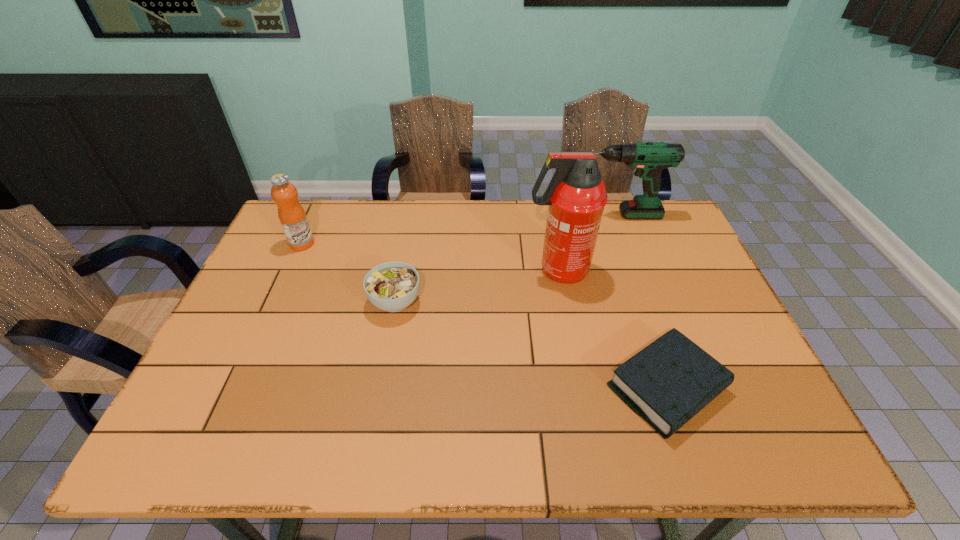
You are a GUI agent. You are given a task and a screenshot of the screen. Output one action in this format:
    pyautogui.click(x=<x>, y=<y>)
    Task: Click on the vacant space at the far right corner of the desktop
    The width and height of the screenshot is (960, 540).
    Given the screenshot: What is the action you would take?
    pyautogui.click(x=685, y=236)

Where is `vacant space that is in between the drill and the second shortest object`? The image size is (960, 540). vacant space that is in between the drill and the second shortest object is located at coordinates (506, 258).

This screenshot has width=960, height=540. I want to click on vacant space in between the fourth tallest object and the shortest object, so click(x=531, y=345).

The image size is (960, 540). I want to click on empty space that is in between the drill and the leftmost object, so click(459, 230).

Locate an element on the screen. The width and height of the screenshot is (960, 540). free space between the Bible and the tallest object is located at coordinates (612, 329).

Image resolution: width=960 pixels, height=540 pixels. Identify the location of blank region between the fire extinguisher and the nearest object. (612, 329).

Image resolution: width=960 pixels, height=540 pixels. What are the coordinates of `empty space that is in between the fourth tallest object and the leftmost object` in the screenshot? It's located at (348, 273).

Identify the location of empty space between the drill and the fruit juice. (459, 230).

Find the location of a particular element. The width and height of the screenshot is (960, 540). vacant area between the tallest object and the leftmost object is located at coordinates (430, 257).

Locate an element on the screen. free spot between the second object from left to right and the fire extinguisher is located at coordinates (476, 286).